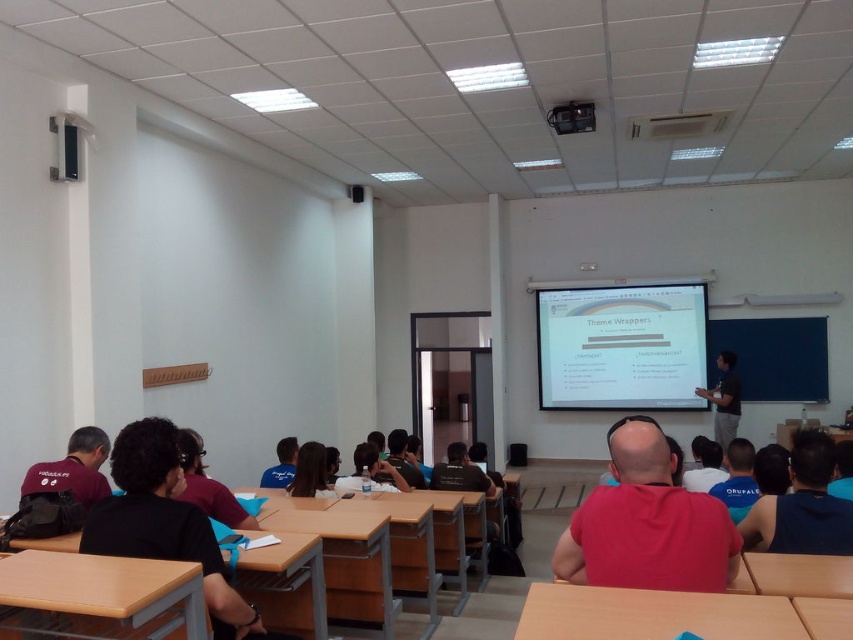
You are a student sitting at the wooden table at lower right and want to hand a paper to the person wearing the black shirt at upper right. Which direction should you move to reach them?

The wooden table at lower right is to the left of the black shirt at upper right, so you should move to the right to reach them.

You are organizing a small event in the classroom and need to place a 10cm wide decorative item on either the wooden table at lower right or the black shirt at upper right. Based on their widths, which object can accommodate the item without it falling off?

The black shirt at upper right is wider than the wooden table at lower right, so the decorative item can be placed on the black shirt at upper right since it has enough width to support it.

You are a student sitting at the wooden table at lower center and need to pass a note to your friend sitting at the wooden table at center. In which direction should you move to reach them?

The wooden table at lower center is to the left of the wooden table at center, so you should move to the right to reach your friend.